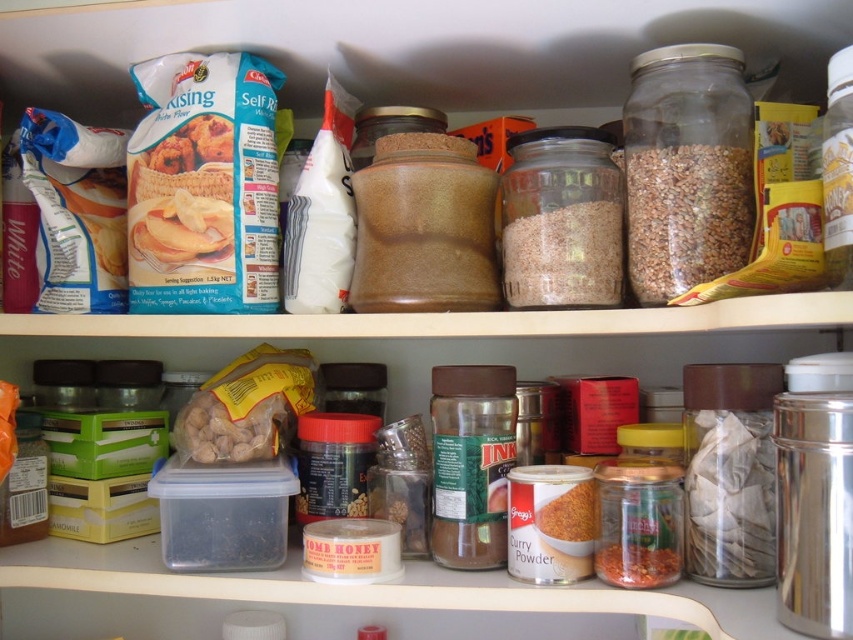
Question: Observing the image, what is the correct spatial positioning of translucent glass jar at center in reference to reddish-brown powder at lower center?

Choices:
 (A) right
 (B) left

Answer: (B)

Question: Which point is farther to the camera?

Choices:
 (A) brown matte grain at upper right
 (B) translucent glass jar at center
 (C) reddish-brown powder at lower center

Answer: (B)

Question: Is brown matte grain at upper right smaller than translucent glass jar at center?

Choices:
 (A) no
 (B) yes

Answer: (A)

Question: Among these points, which one is nearest to the camera?

Choices:
 (A) (723, 228)
 (B) (566, 205)

Answer: (A)

Question: Is translucent glass jar at center smaller than reddish-brown powder at lower center?

Choices:
 (A) yes
 (B) no

Answer: (B)

Question: Which of the following is the closest to the observer?

Choices:
 (A) (583, 218)
 (B) (601, 540)
 (C) (717, 200)

Answer: (C)